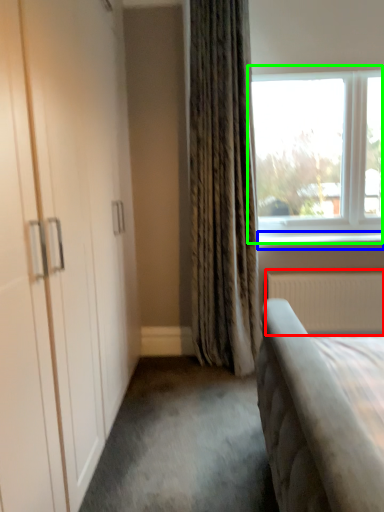
Question: Considering the real-world distances, which object is closest to radiator (highlighted by a red box)? window sill (highlighted by a blue box) or window (highlighted by a green box).

Choices:
 (A) window sill
 (B) window

Answer: (A)